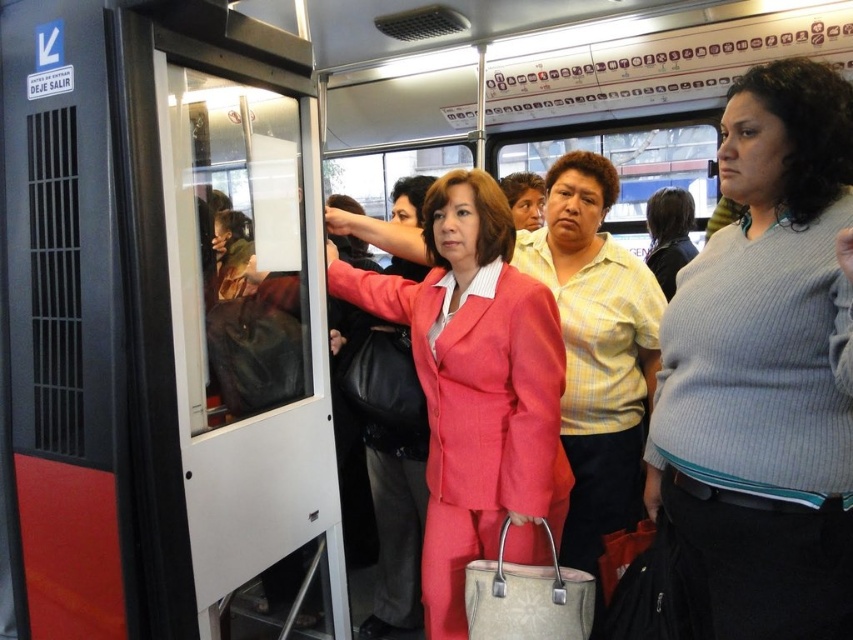
Question: Considering the relative positions of matte pink suit at center and dark brown hair at center in the image provided, where is matte pink suit at center located with respect to dark brown hair at center?

Choices:
 (A) left
 (B) right

Answer: (A)

Question: Estimate the real-world distances between objects in this image. Which object is farther from the matte pink suit at center?

Choices:
 (A) dark brown hair at center
 (B) ribbed gray sweater at right
 (C) yellow striped shirt at center

Answer: (A)

Question: Can you confirm if matte pink suit at center is positioned above dark brown hair at center?

Choices:
 (A) no
 (B) yes

Answer: (A)

Question: Considering the real-world distances, which object is closest to the yellow striped shirt at center?

Choices:
 (A) matte pink suit at center
 (B) ribbed gray sweater at right

Answer: (A)

Question: Which point is closer to the camera?

Choices:
 (A) (463, 532)
 (B) (695, 259)
 (C) (656, 204)
 (D) (612, 442)

Answer: (B)

Question: Can you confirm if ribbed gray sweater at right is positioned to the left of yellow striped shirt at center?

Choices:
 (A) yes
 (B) no

Answer: (B)